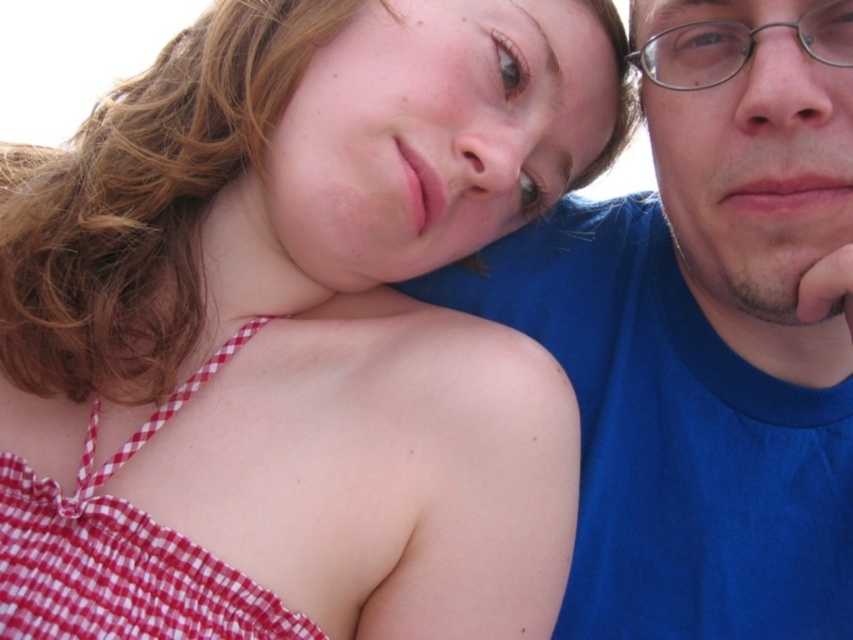
What are the coordinates of the blue cotton shirt at upper right?

The blue cotton shirt at upper right is located at point (701, 362).

You are taking a photo of two people standing in front of you. You notice two points on their bodies labeled as point (x=697, y=209) and point (x=664, y=74). If you want to focus on the point closer to you, which point should you choose?

Point (x=664, y=74) is closer to the camera than point (x=697, y=209), so you should choose point (x=664, y=74) to focus on the point closer to you.